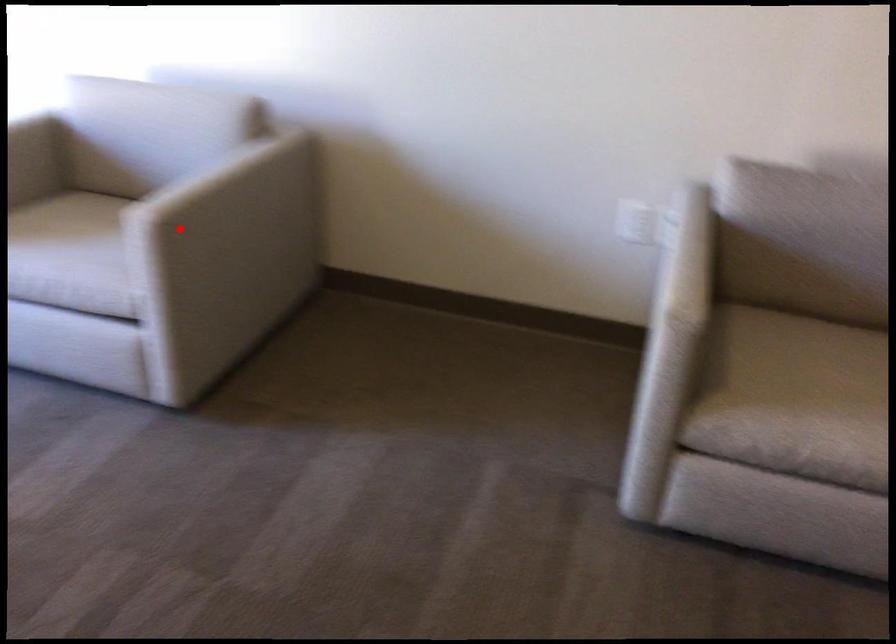
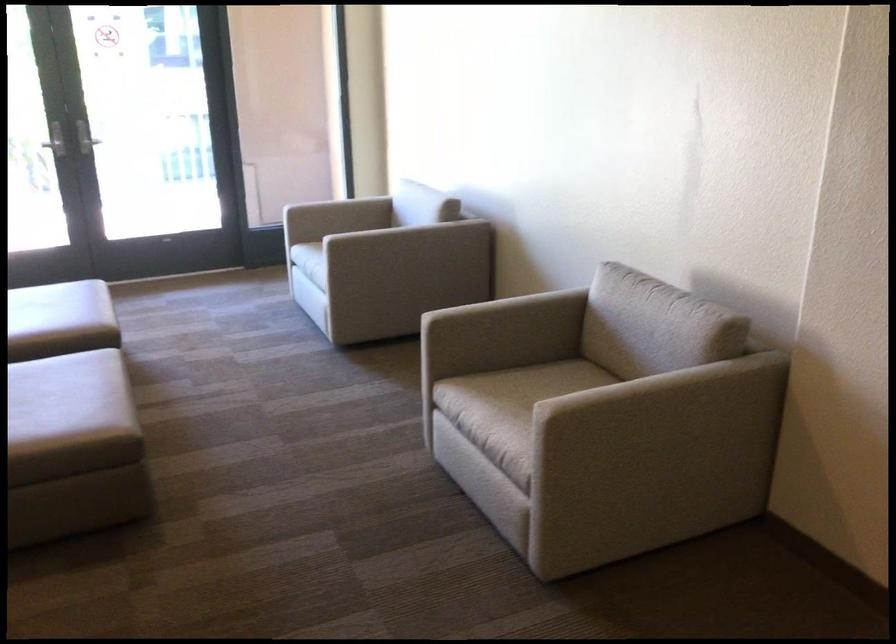
In the second image, find the point that corresponds to the highlighted location in the first image.

(316, 240)